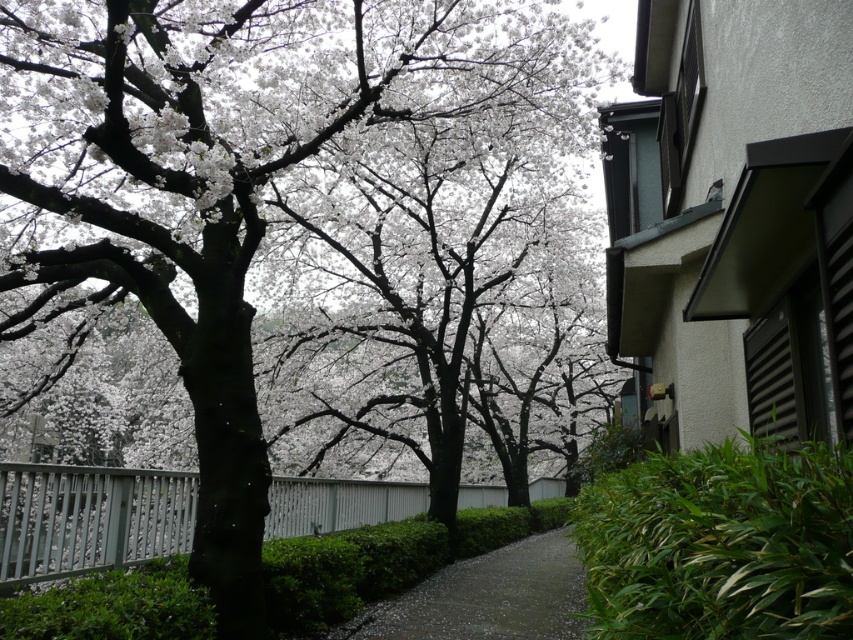
You are standing on the paved pathway and want to take a photo of the white blossoms at center. Which direction should you face to capture them in your camera view?

The white blossoms at center are located at point coordinates, so you should face towards the center of the scene to capture them in your photo.

You are a gardener planning to place a 1.2 meter tall decorative statue on the dark gray gravel path at center. Based on the scene, will the statue be visible above the white blossoms at center?

The white blossoms at center are taller than the dark gray gravel path at center. Since the statue is 1.2 meters tall, it will likely be visible above the white blossoms at center as long as it is placed on the path.